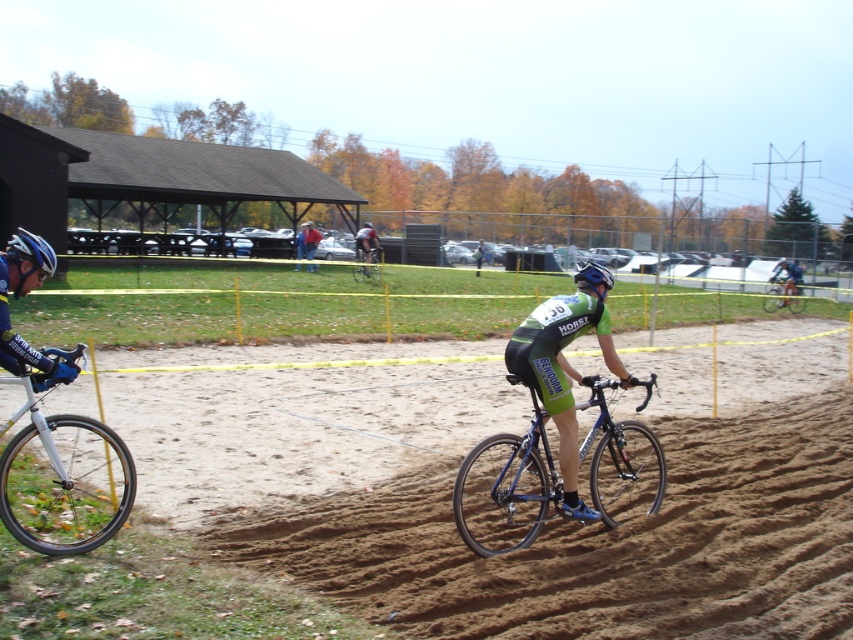
Question: Does brown sandy dirt at center have a greater width compared to shiny blue bicycle at center?

Choices:
 (A) no
 (B) yes

Answer: (B)

Question: Which object appears farthest from the camera in this image?

Choices:
 (A) shiny blue helmet at left
 (B) shiny blue bike at center
 (C) silver metallic bicycle wheel at left
 (D) blue metallic bicycle at center

Answer: (D)

Question: Considering the real-world distances, which object is closest to the denim jacket at center?

Choices:
 (A) shiny blue helmet at left
 (B) silver metallic bicycle wheel at left

Answer: (A)

Question: Can you confirm if shiny blue bike at center is positioned to the left of blue metallic bicycle at center?

Choices:
 (A) no
 (B) yes

Answer: (B)

Question: Which point appears farthest from the camera in this image?

Choices:
 (A) click(x=369, y=275)
 (B) click(x=778, y=298)
 (C) click(x=604, y=268)
 (D) click(x=631, y=444)

Answer: (B)

Question: Does brown sandy dirt at center have a smaller size compared to shiny blue bike at center?

Choices:
 (A) yes
 (B) no

Answer: (B)